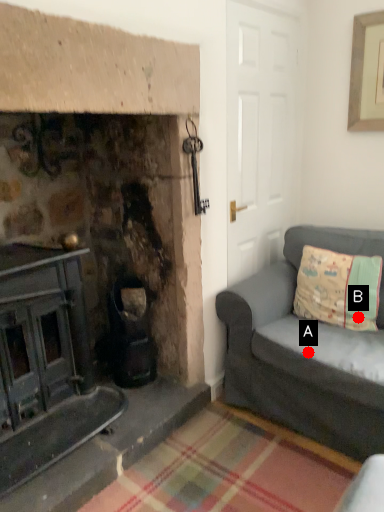
Question: Two points are circled on the image, labeled by A and B beside each circle. Which point is closer to the camera?

Choices:
 (A) A is closer
 (B) B is closer

Answer: (A)